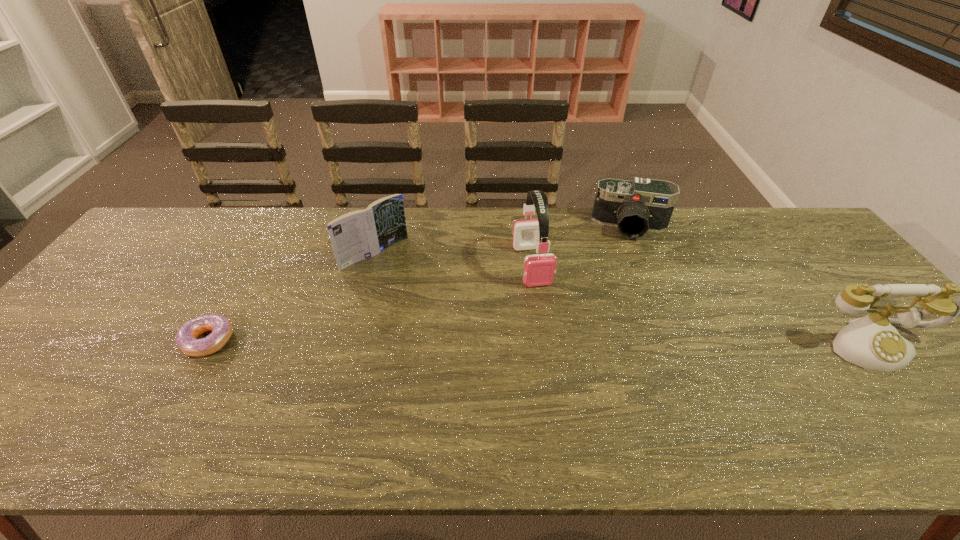
You are a GUI agent. You are given a task and a screenshot of the screen. Output one action in this format:
    pyautogui.click(x=<x>, y=<y>)
    Task: Click on the free region that satisfies the following two spatial constraints: 1. on the back side of the third object from right to left; 2. on the right side of the camera
    The image size is (960, 540).
    Given the screenshot: What is the action you would take?
    pyautogui.click(x=527, y=226)

You are a GUI agent. You are given a task and a screenshot of the screen. Output one action in this format:
    pyautogui.click(x=<x>, y=<y>)
    Task: Click on the free location that satisfies the following two spatial constraints: 1. on the back side of the doughnut; 2. on the left side of the tallest object
    
    Given the screenshot: What is the action you would take?
    pyautogui.click(x=252, y=265)

The width and height of the screenshot is (960, 540). Identify the location of vacant space that satisfies the following two spatial constraints: 1. on the back side of the fourth object from right to left; 2. on the right side of the shortest object. (258, 254).